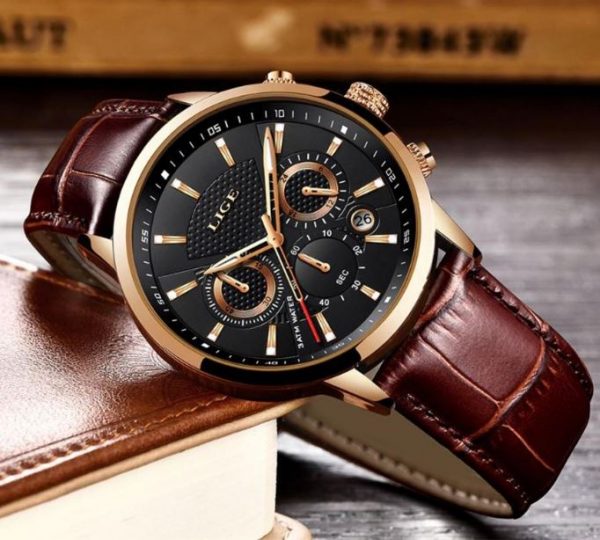
Image resolution: width=600 pixels, height=540 pixels. Identify the location of book. (168, 482).